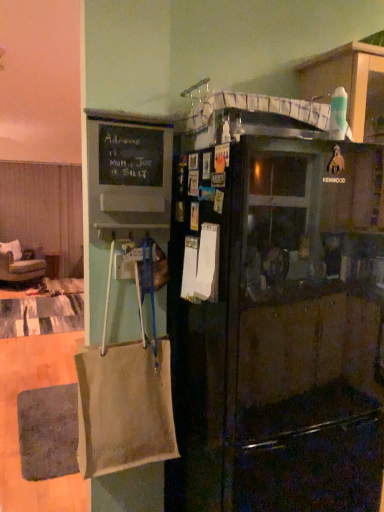
Question: Does green fabric chair at left lie behind black matte refrigerator at center?

Choices:
 (A) yes
 (B) no

Answer: (A)

Question: Could you tell me if green fabric chair at left is turned towards black matte refrigerator at center?

Choices:
 (A) yes
 (B) no

Answer: (A)

Question: Is green fabric chair at left to the right of black matte refrigerator at center from the viewer's perspective?

Choices:
 (A) no
 (B) yes

Answer: (A)

Question: Is green fabric chair at left wider than black matte refrigerator at center?

Choices:
 (A) yes
 (B) no

Answer: (A)

Question: Is green fabric chair at left positioned in front of black matte refrigerator at center?

Choices:
 (A) no
 (B) yes

Answer: (A)

Question: In terms of size, does black matte refrigerator at center appear bigger or smaller than beige fabric curtain at left?

Choices:
 (A) small
 (B) big

Answer: (B)

Question: Does point (284, 244) appear closer or farther from the camera than point (21, 192)?

Choices:
 (A) farther
 (B) closer

Answer: (B)

Question: Which is correct: black matte refrigerator at center is inside beige fabric curtain at left, or outside of it?

Choices:
 (A) outside
 (B) inside

Answer: (A)

Question: From the image's perspective, is black matte refrigerator at center above or below beige fabric curtain at left?

Choices:
 (A) above
 (B) below

Answer: (B)

Question: Would you say green fabric chair at left is inside or outside beige canvas bag at left?

Choices:
 (A) inside
 (B) outside

Answer: (B)

Question: Considering the positions of green fabric chair at left and beige canvas bag at left in the image, is green fabric chair at left bigger or smaller than beige canvas bag at left?

Choices:
 (A) big
 (B) small

Answer: (A)

Question: Is point (13, 280) positioned closer to the camera than point (109, 468)?

Choices:
 (A) closer
 (B) farther

Answer: (B)

Question: From the image's perspective, is green fabric chair at left above or below beige canvas bag at left?

Choices:
 (A) below
 (B) above

Answer: (B)

Question: In terms of height, does black chalkboard at upper left look taller or shorter compared to green fabric chair at left?

Choices:
 (A) short
 (B) tall

Answer: (A)

Question: Is black chalkboard at upper left in front of or behind green fabric chair at left in the image?

Choices:
 (A) behind
 (B) front

Answer: (B)